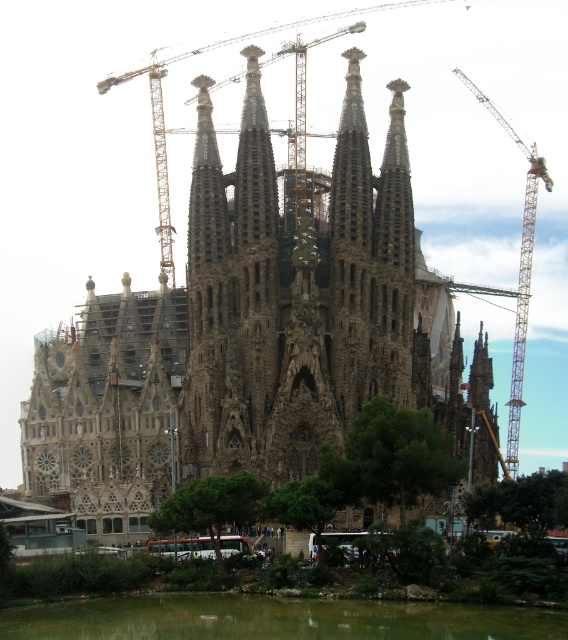
Is brown stone church at center smaller than green liquid water at lower center?

No.

What do you see at coordinates (252, 330) in the screenshot? This screenshot has width=568, height=640. I see `brown stone church at center` at bounding box center [252, 330].

I want to click on brown stone church at center, so click(x=252, y=330).

Does green liquid water at lower center appear on the left side of metallic construction crane at upper center?

No, green liquid water at lower center is not to the left of metallic construction crane at upper center.

Between green liquid water at lower center and metallic construction crane at upper center, which one has more height?

metallic construction crane at upper center

Identify the location of green liquid water at lower center. This screenshot has width=568, height=640. (274, 618).

Where is `green liquid water at lower center`? The height and width of the screenshot is (640, 568). green liquid water at lower center is located at coordinates (274, 618).

This screenshot has width=568, height=640. I want to click on yellow metallic crane at upper right, so click(x=519, y=269).

Is point (515, 436) positioned after point (296, 20)?

No, (515, 436) is closer to viewer.

Identify the location of yellow metallic crane at upper right. This screenshot has height=640, width=568. (519, 269).